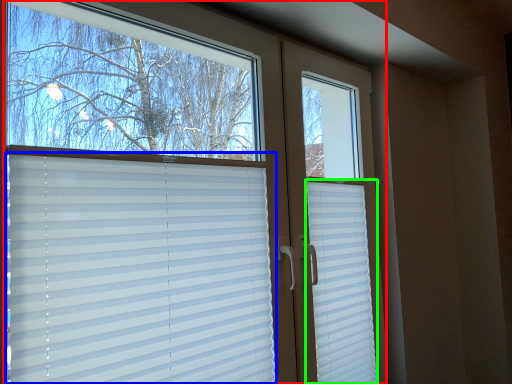
Question: Which object is the closest to the window (highlighted by a red box)? Choose among these: window blind (highlighted by a blue box) or shutter (highlighted by a green box).

Choices:
 (A) window blind
 (B) shutter

Answer: (A)